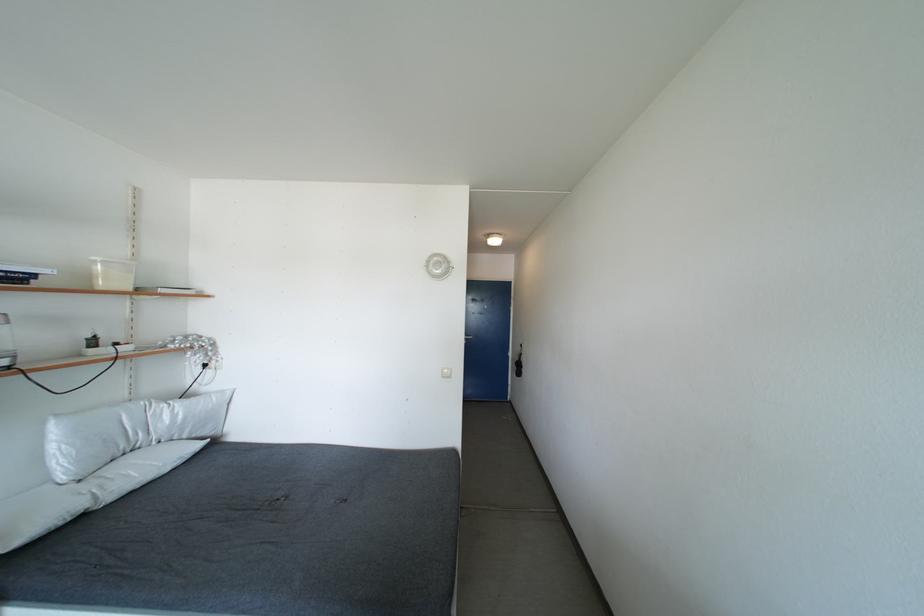
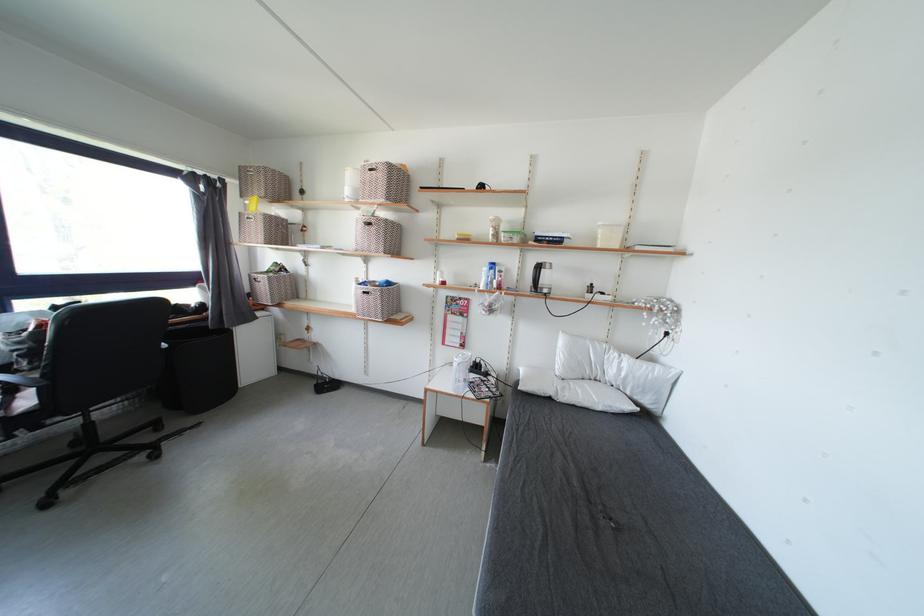
Find the pixel in the second image that matches (x=58, y=452) in the first image.

(565, 355)